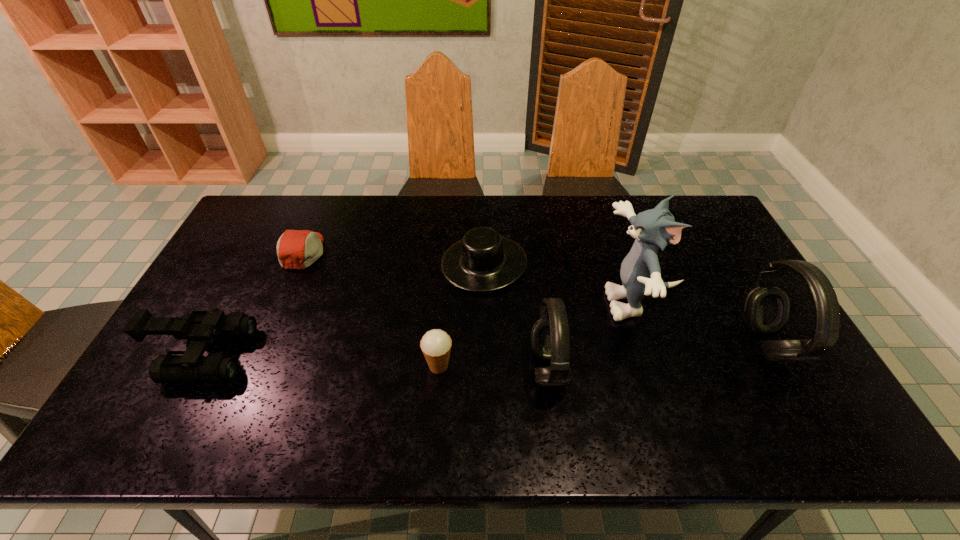
This screenshot has width=960, height=540. I want to click on cap at the far edge, so click(296, 249).

Identify the location of dress hat located at the far edge. This screenshot has height=540, width=960. (483, 260).

Image resolution: width=960 pixels, height=540 pixels. In order to click on icecream that is at the near edge in this screenshot , I will do `click(436, 344)`.

The image size is (960, 540). I want to click on binoculars that is at the near edge, so click(201, 327).

At what (x,y) coordinates should I click in order to perform the action: click on object present at the left edge. Please return your answer as a coordinate pair (x, y). The width and height of the screenshot is (960, 540). Looking at the image, I should click on pos(201,327).

Locate an element on the screen. object positioned at the right edge is located at coordinates (766, 308).

The image size is (960, 540). What are the coordinates of `object present at the near left corner` in the screenshot? It's located at (201, 327).

Locate an element on the screen. Image resolution: width=960 pixels, height=540 pixels. object that is at the near right corner is located at coordinates (766, 308).

Locate an element on the screen. free space at the far edge is located at coordinates (339, 227).

What are the coordinates of `free space at the near edge of the desktop` in the screenshot? It's located at (283, 392).